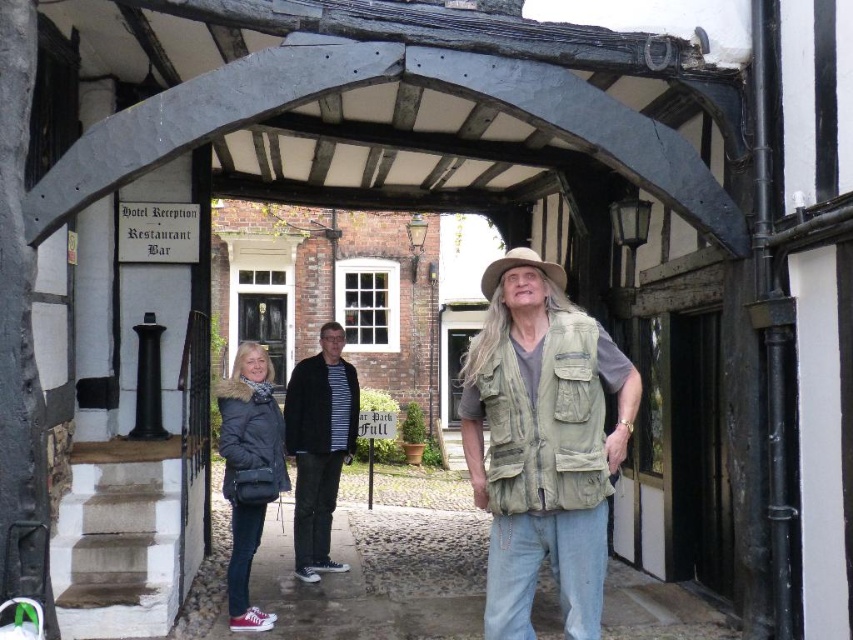
Does khaki fabric vest at center have a greater width compared to beige fabric cowboy hat at center?

No.

Does point (573, 508) come behind point (561, 275)?

No, it is not.

Does point (552, 461) lie behind point (546, 262)?

No, (552, 461) is closer to viewer.

This screenshot has width=853, height=640. What are the coordinates of `khaki fabric vest at center` in the screenshot? It's located at (543, 442).

Is point (306, 365) farther from viewer compared to point (521, 264)?

Yes, it is.

Between striped cotton shirt at center and beige fabric cowboy hat at center, which one is positioned higher?

Positioned higher is beige fabric cowboy hat at center.

What do you see at coordinates (318, 445) in the screenshot? I see `striped cotton shirt at center` at bounding box center [318, 445].

Find the location of a particular element. striped cotton shirt at center is located at coordinates (318, 445).

Is striped cotton shirt at center smaller than matte black jacket at lower left?

Yes.

Is striped cotton shirt at center positioned before matte black jacket at lower left?

No, striped cotton shirt at center is behind matte black jacket at lower left.

Locate an element on the screen. The image size is (853, 640). striped cotton shirt at center is located at coordinates (318, 445).